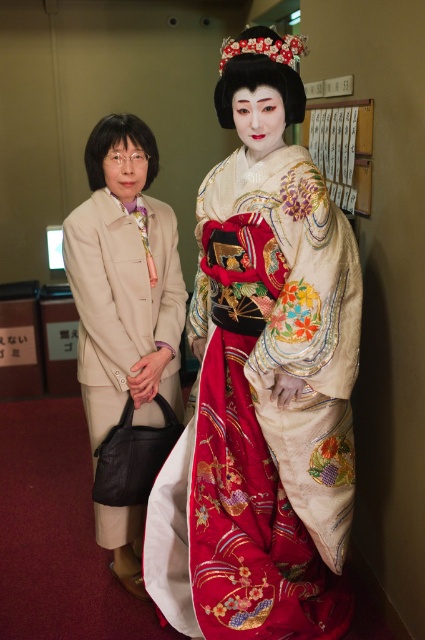
Question: Does silky white kimono at center appear on the right side of beige fabric robe at left?

Choices:
 (A) no
 (B) yes

Answer: (B)

Question: Does silky white kimono at center appear on the right side of beige fabric robe at left?

Choices:
 (A) no
 (B) yes

Answer: (B)

Question: Considering the relative positions of silky white kimono at center and beige fabric robe at left in the image provided, where is silky white kimono at center located with respect to beige fabric robe at left?

Choices:
 (A) left
 (B) right

Answer: (B)

Question: Which point appears farthest from the camera in this image?

Choices:
 (A) (212, 296)
 (B) (167, 260)

Answer: (B)